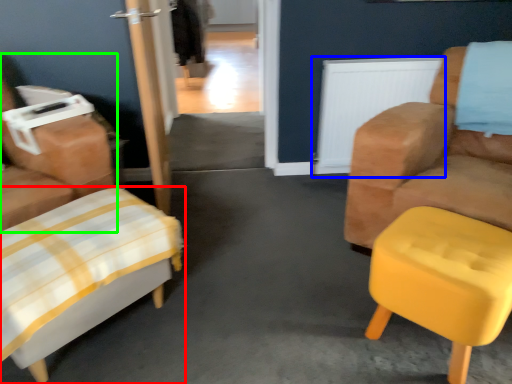
Question: Estimate the real-world distances between objects in this image. Which object is closer to furniture (highlighted by a red box), radiator (highlighted by a blue box) or chair (highlighted by a green box)?

Choices:
 (A) radiator
 (B) chair

Answer: (B)